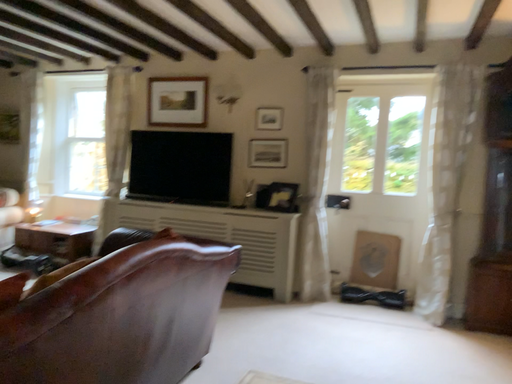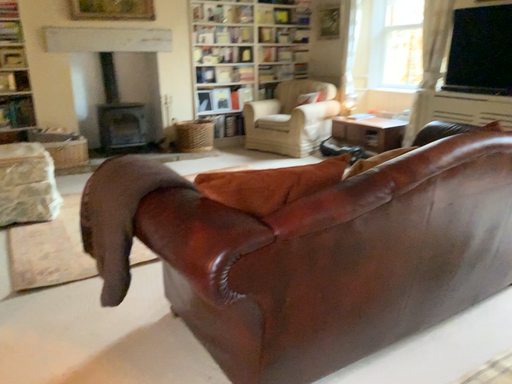
Question: How did the camera likely rotate when shooting the video?

Choices:
 (A) rotated right
 (B) rotated left

Answer: (B)